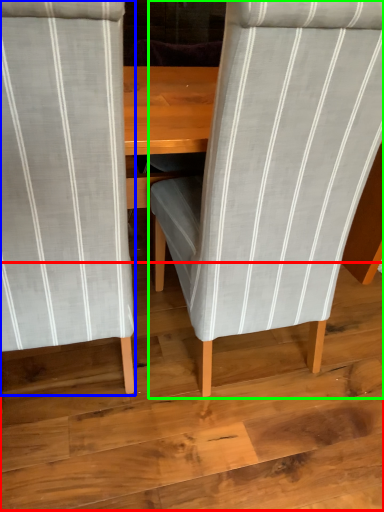
Question: Considering the real-world distances, which object is farthest from plywood (highlighted by a red box)? chair (highlighted by a blue box) or chair (highlighted by a green box)?

Choices:
 (A) chair
 (B) chair

Answer: (A)